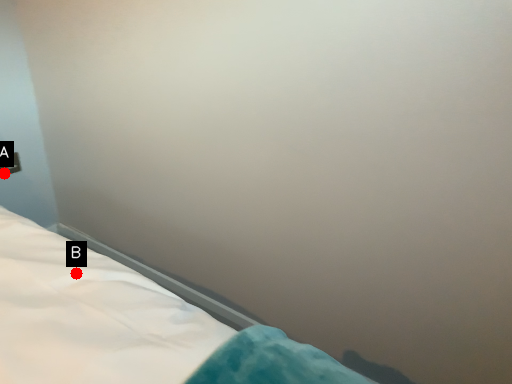
Question: Two points are circled on the image, labeled by A and B beside each circle. Which point is further to the camera?

Choices:
 (A) A is further
 (B) B is further

Answer: (A)